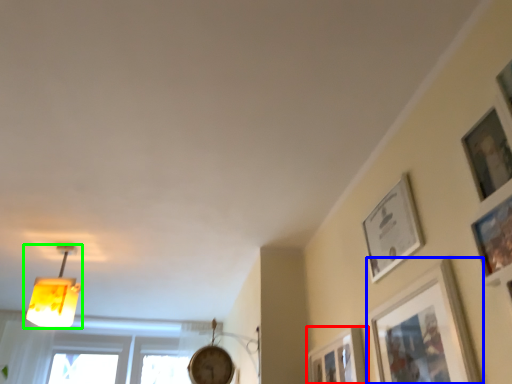
Question: Based on their relative distances, which object is nearer to picture frame (highlighted by a red box)? Choose from picture frame (highlighted by a blue box) and lamp (highlighted by a green box).

Choices:
 (A) picture frame
 (B) lamp

Answer: (A)